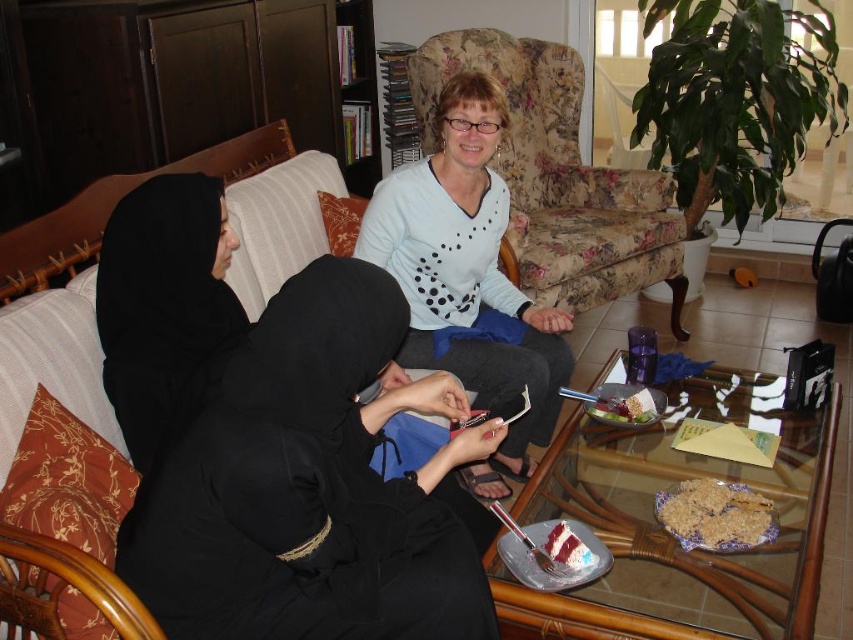
Question: Is floral fabric armchair at center smaller than white ceramic plate at lower center?

Choices:
 (A) yes
 (B) no

Answer: (B)

Question: Which point is farther from the camera taking this photo?

Choices:
 (A) (572, 538)
 (B) (537, 324)
 (C) (627, 237)
 (D) (659, 481)

Answer: (C)

Question: Based on their relative distances, which object is nearer to the crumbly brown cake at lower center?

Choices:
 (A) white dotted sweater at upper center
 (B) white ceramic plate at lower center

Answer: (B)

Question: Which of the following is the closest to the observer?

Choices:
 (A) (778, 476)
 (B) (572, 568)

Answer: (B)

Question: Does transparent glass table at center have a smaller size compared to strawberry cake at center?

Choices:
 (A) yes
 (B) no

Answer: (B)

Question: Does transparent glass table at center have a lesser width compared to white dotted sweater at upper center?

Choices:
 (A) no
 (B) yes

Answer: (A)